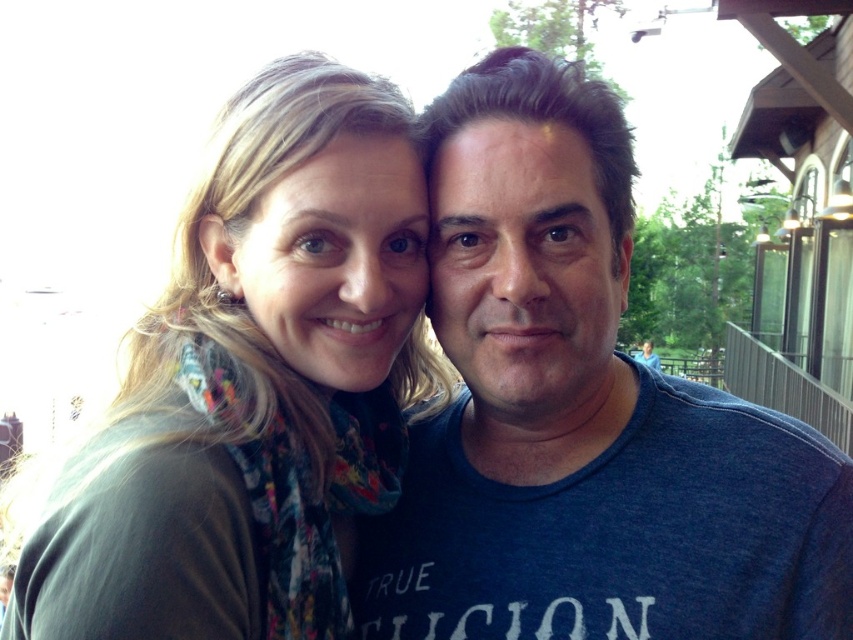
Does blue cotton shirt at center lie behind multicolored scarf at center?

Yes.

Between blue cotton shirt at center and multicolored scarf at center, which one appears on the left side from the viewer's perspective?

Positioned to the left is multicolored scarf at center.

Does point (750, 461) come farther from viewer compared to point (277, 225)?

Yes, it is.

Locate an element on the screen. blue cotton shirt at center is located at coordinates [582, 416].